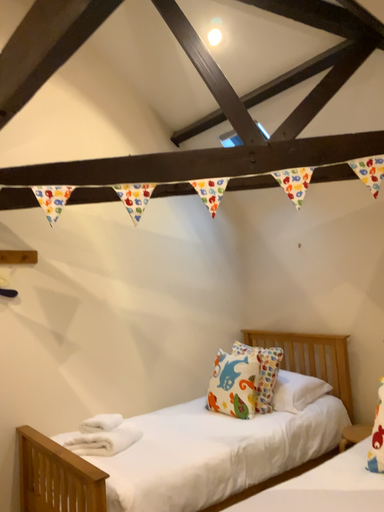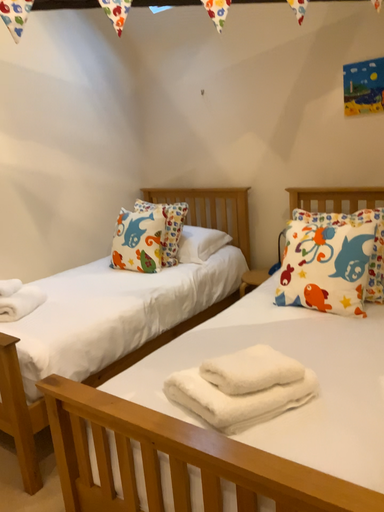
Question: How did the camera likely rotate when shooting the video?

Choices:
 (A) rotated right
 (B) rotated left

Answer: (A)